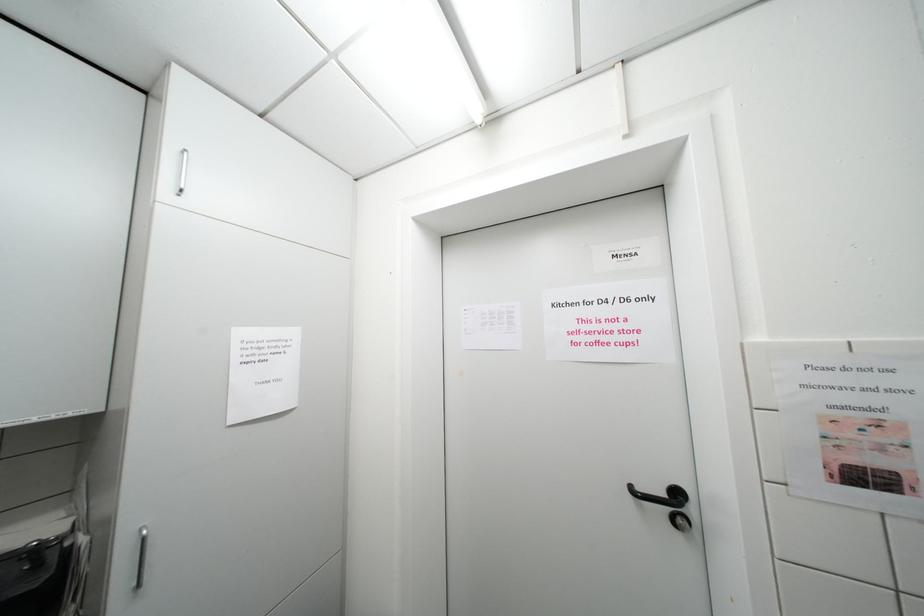
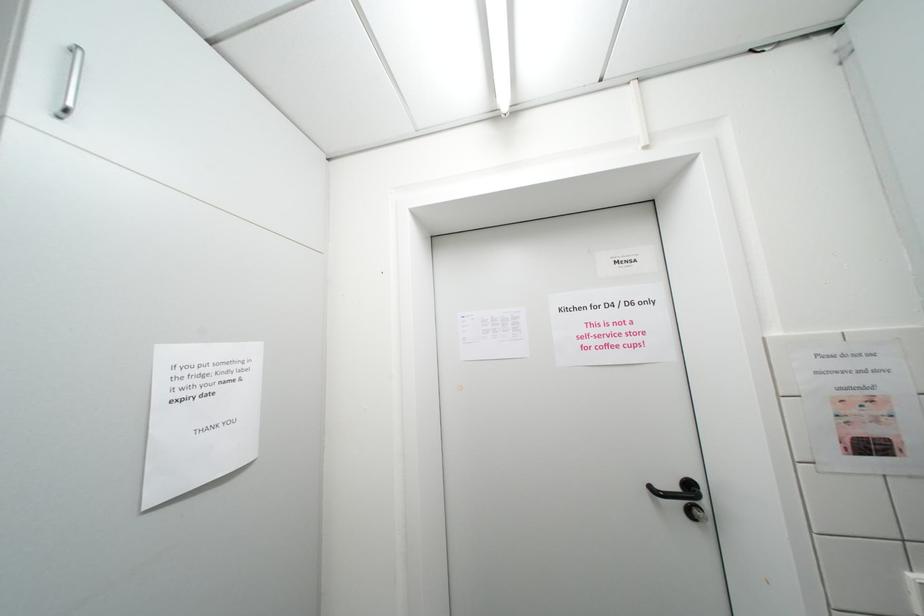
Question: The camera is either moving clockwise (left) or counter-clockwise (right) around the object. The first image is from the beginning of the video and the second image is from the end. Is the camera moving left or right when shooting the video?

Choices:
 (A) Left
 (B) Right

Answer: (A)